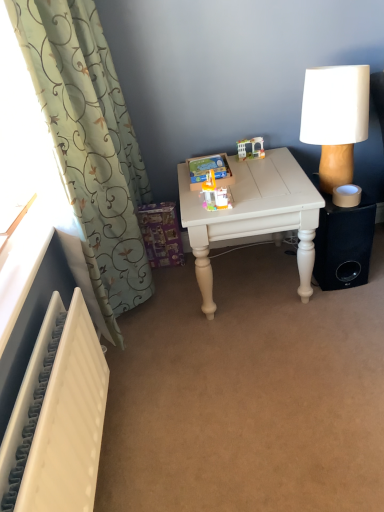
What are the coordinates of `green fabric curtain at left` in the screenshot? It's located at (90, 146).

Find the location of a particular element. This screenshot has height=512, width=384. white textured radiator at lower left is located at coordinates (57, 417).

Image resolution: width=384 pixels, height=512 pixels. Describe the element at coordinates (254, 215) in the screenshot. I see `white painted wood table at center` at that location.

Locate an element on the screen. white painted wood table at center is located at coordinates (254, 215).

What do you see at coordinates (344, 244) in the screenshot? I see `black matte speaker at lower right` at bounding box center [344, 244].

At what (x,y) coordinates should I click in order to perform the action: click on black matte speaker at lower right. Please return your answer as a coordinate pair (x, y). Image resolution: width=384 pixels, height=512 pixels. Looking at the image, I should click on (344, 244).

What do you see at coordinates (335, 118) in the screenshot? I see `white fabric-covered lamp at right` at bounding box center [335, 118].

Image resolution: width=384 pixels, height=512 pixels. Identify the location of translucent plastic toy at center, positioned as the second toy in back-to-front order. (214, 194).

The image size is (384, 512). Identify the location of green fabric curtain at left. (90, 146).

Is white textured radiator at lower left looking in the opposite direction of green fabric curtain at left?

No, white textured radiator at lower left is not facing away from green fabric curtain at left.

Considering the points (52, 401) and (44, 32), which point is in front, point (52, 401) or point (44, 32)?

The point (52, 401) is more forward.

Who is taller, white textured radiator at lower left or green fabric curtain at left?

Standing taller between the two is green fabric curtain at left.

From the image's perspective, is white textured radiator at lower left beneath green fabric curtain at left?

Yes.

What's the angular difference between translucent plastic toy house at upper center, which is the 2th toy from left to right, and white textured radiator at lower left's facing directions?

The angle between the facing direction of translucent plastic toy house at upper center, which is the 2th toy from left to right, and the facing direction of white textured radiator at lower left is 92.8 degrees.

Does translucent plastic toy house at upper center, which is the first toy in right-to-left order, touch white textured radiator at lower left?

No.

From a real-world perspective, is translucent plastic toy house at upper center, which is the first toy in right-to-left order, located higher than white textured radiator at lower left?

Indeed, from a real-world perspective, translucent plastic toy house at upper center, which is the first toy in right-to-left order, stands above white textured radiator at lower left.

Considering the sizes of translucent plastic toy house at upper center, the second toy in the bottom-to-top sequence, and white textured radiator at lower left in the image, is translucent plastic toy house at upper center, the second toy in the bottom-to-top sequence, bigger or smaller than white textured radiator at lower left?

In the image, translucent plastic toy house at upper center, the second toy in the bottom-to-top sequence, appears to be smaller than white textured radiator at lower left.

Is green fabric curtain at left directly adjacent to translucent plastic toy house at upper center, which is the 2th toy from left to right?

No, green fabric curtain at left is not in contact with translucent plastic toy house at upper center, which is the 2th toy from left to right.

From the image's perspective, is green fabric curtain at left on translucent plastic toy house at upper center, the second toy in the bottom-to-top sequence?

No, from the image's perspective, green fabric curtain at left is not over translucent plastic toy house at upper center, the second toy in the bottom-to-top sequence.

Is green fabric curtain at left bigger or smaller than translucent plastic toy house at upper center, positioned as the first toy in back-to-front order?

Clearly, green fabric curtain at left is larger in size than translucent plastic toy house at upper center, positioned as the first toy in back-to-front order.

Is green fabric curtain at left inside or outside of translucent plastic toy house at upper center, the second toy in the bottom-to-top sequence?

green fabric curtain at left is spatially situated outside translucent plastic toy house at upper center, the second toy in the bottom-to-top sequence.

Which is farther, (336,280) or (362,108)?

Positioned behind is point (336,280).

From the image's perspective, between black matte speaker at lower right and white fabric-covered lamp at right, which one is located above?

white fabric-covered lamp at right is shown above in the image.

Which object is positioned more to the right, black matte speaker at lower right or white fabric-covered lamp at right?

black matte speaker at lower right is more to the right.

Measure the distance between black matte speaker at lower right and white fabric-covered lamp at right.

A distance of 10.25 inches exists between black matte speaker at lower right and white fabric-covered lamp at right.

I want to click on table that is above the white textured radiator at lower left (from the image's perspective), so click(254, 215).

Is white textured radiator at lower left inside or outside of white painted wood table at center?

white textured radiator at lower left is outside white painted wood table at center.

Considering the relative sizes of white textured radiator at lower left and white painted wood table at center in the image provided, is white textured radiator at lower left taller than white painted wood table at center?

In fact, white textured radiator at lower left may be shorter than white painted wood table at center.

Is there a large distance between white textured radiator at lower left and white painted wood table at center?

white textured radiator at lower left is near white painted wood table at center, not far away.

Based on the photo, between green fabric curtain at left and white painted wood table at center, which one has less height?

white painted wood table at center is shorter.

In the scene shown: Is green fabric curtain at left aimed at white painted wood table at center?

Yes, green fabric curtain at left faces towards white painted wood table at center.

Is the position of green fabric curtain at left less distant than that of white painted wood table at center?

Yes, green fabric curtain at left is closer to the viewer.

Identify the location of table that is behind the green fabric curtain at left. The width and height of the screenshot is (384, 512). (254, 215).

Where is `toy in front of the translucent plastic toy house at upper center, positioned as the first toy in back-to-front order`? The height and width of the screenshot is (512, 384). toy in front of the translucent plastic toy house at upper center, positioned as the first toy in back-to-front order is located at coordinates (214, 194).

Which is behind, translucent plastic toy at center, the 1th toy in the front-to-back sequence, or translucent plastic toy house at upper center, the 1th toy in the top-to-bottom sequence?

translucent plastic toy house at upper center, the 1th toy in the top-to-bottom sequence, is more distant.

From a real-world perspective, who is located lower, translucent plastic toy at center, the 1th toy in the front-to-back sequence, or translucent plastic toy house at upper center, the second toy in the bottom-to-top sequence?

In real-world perspective, translucent plastic toy house at upper center, the second toy in the bottom-to-top sequence, is lower.

Is translucent plastic toy at center, the first toy from the bottom, oriented away from translucent plastic toy house at upper center, the second toy in the bottom-to-top sequence?

Yes.

Locate an element on the screen. The height and width of the screenshot is (512, 384). curtain behind the white textured radiator at lower left is located at coordinates (90, 146).

This screenshot has width=384, height=512. Find the location of `radiator that is on the left side of translucent plastic toy house at upper center, which is the 2th toy from left to right`. radiator that is on the left side of translucent plastic toy house at upper center, which is the 2th toy from left to right is located at coordinates (57, 417).

Looking at this image, when comparing their distances from white textured radiator at lower left, does white painted wood table at center or translucent plastic toy house at upper center, the second toy viewed from the front, seem closer?

white painted wood table at center is positioned closer to the anchor white textured radiator at lower left.

Estimate the real-world distances between objects in this image. Which object is closer to translucent plastic toy at center, the first toy from the bottom, green fabric curtain at left or translucent plastic toy house at upper center, which is the 2th toy from left to right?

Based on the image, translucent plastic toy house at upper center, which is the 2th toy from left to right, appears to be nearer to translucent plastic toy at center, the first toy from the bottom.

When comparing their distances from black matte speaker at lower right, does translucent plastic toy at center, the second toy in the right-to-left sequence, or white textured radiator at lower left seem further?

white textured radiator at lower left lies further to black matte speaker at lower right than the other object.

Based on their spatial positions, is translucent plastic toy house at upper center, which is the 2th toy from left to right, or black matte speaker at lower right further from white textured radiator at lower left?

The object further to white textured radiator at lower left is translucent plastic toy house at upper center, which is the 2th toy from left to right.

Considering their positions, is black matte speaker at lower right positioned closer to white textured radiator at lower left than green fabric curtain at left?

Based on the image, green fabric curtain at left appears to be nearer to white textured radiator at lower left.

From the image, which object appears to be nearer to translucent plastic toy house at upper center, positioned as the first toy in back-to-front order, white painted wood table at center or white fabric-covered lamp at right?

The object closer to translucent plastic toy house at upper center, positioned as the first toy in back-to-front order, is white painted wood table at center.

Considering their positions, is white fabric-covered lamp at right positioned closer to white textured radiator at lower left than green fabric curtain at left?

Based on the image, green fabric curtain at left appears to be nearer to white textured radiator at lower left.

Estimate the real-world distances between objects in this image. Which object is further from green fabric curtain at left, translucent plastic toy house at upper center, the 1th toy in the top-to-bottom sequence, or translucent plastic toy at center, the first toy from the bottom?

Based on the image, translucent plastic toy house at upper center, the 1th toy in the top-to-bottom sequence, appears to be further to green fabric curtain at left.

You are a GUI agent. You are given a task and a screenshot of the screen. Output one action in this format:
    pyautogui.click(x=<x>, y=<y>)
    Task: Click on the curtain positioned between white textured radiator at lower left and white painted wood table at center from near to far
    The image size is (384, 512).
    Given the screenshot: What is the action you would take?
    pyautogui.click(x=90, y=146)

This screenshot has width=384, height=512. Find the location of `table between white fabric-covered lamp at right and translucent plastic toy house at upper center, the second toy viewed from the front, from front to back`. table between white fabric-covered lamp at right and translucent plastic toy house at upper center, the second toy viewed from the front, from front to back is located at coordinates (254, 215).

Find the location of a particular element. The height and width of the screenshot is (512, 384). toy between white textured radiator at lower left and translucent plastic toy house at upper center, the second toy in the bottom-to-top sequence, in the front-back direction is located at coordinates (214, 194).

Locate an element on the screen. The image size is (384, 512). toy between white textured radiator at lower left and white painted wood table at center in the front-back direction is located at coordinates (214, 194).